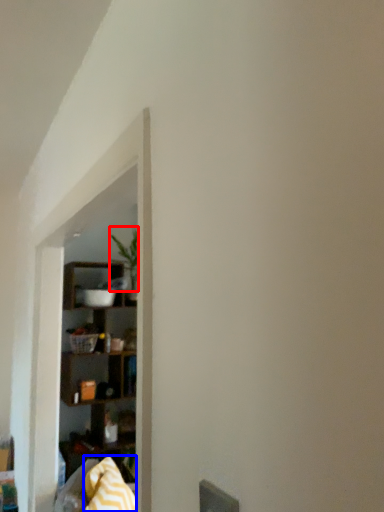
Question: Which of the following is the closest to the observer, plant (highlighted by a red box) or blanket (highlighted by a blue box)?

Choices:
 (A) plant
 (B) blanket

Answer: (B)